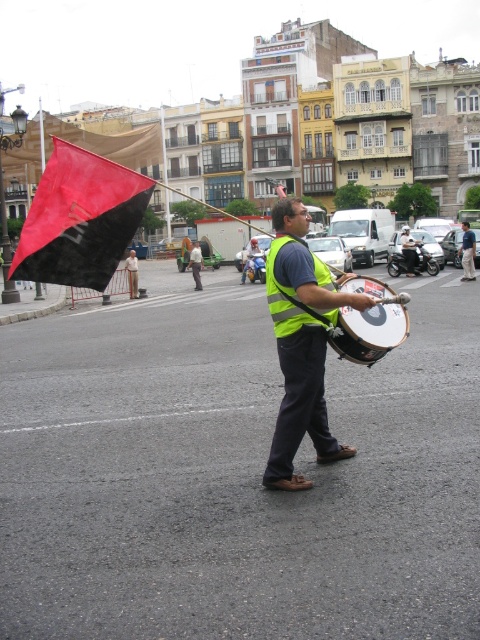
Who is more forward, (463, 252) or (193, 259)?

Point (463, 252) is in front.

Which of these two, dark blue jeans at center or light green fabric shirt at center, stands shorter?

dark blue jeans at center

Who is more forward, (465, 244) or (194, 250)?

Point (465, 244)

I want to click on dark blue jeans at center, so click(468, 252).

Who is higher up, reflective yellow safety vest at center or reflective yellow vest at center?

reflective yellow vest at center

Where is `reflective yellow safety vest at center`? The height and width of the screenshot is (640, 480). reflective yellow safety vest at center is located at coordinates [288, 298].

Is point (275, 301) positioned after point (400, 232)?

No, it is in front of (400, 232).

Locate an element on the screen. reflective yellow safety vest at center is located at coordinates (288, 298).

Which is more to the right, red fabric flag at upper left or yellow reflective vest at center?

From the viewer's perspective, red fabric flag at upper left appears more on the right side.

Can you confirm if red fabric flag at upper left is taller than yellow reflective vest at center?

Yes.

Image resolution: width=480 pixels, height=640 pixels. What do you see at coordinates (80, 218) in the screenshot?
I see `red fabric flag at upper left` at bounding box center [80, 218].

Image resolution: width=480 pixels, height=640 pixels. I want to click on red fabric flag at upper left, so click(x=80, y=218).